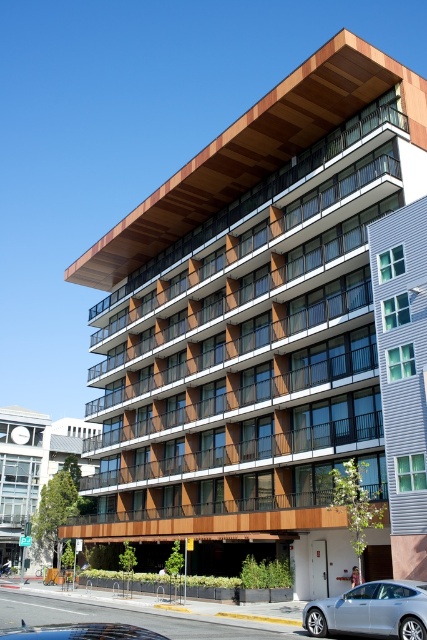
Question: Which point is farther from the camera taking this photo?

Choices:
 (A) (347, 621)
 (B) (400, 304)
 (C) (20, 512)

Answer: (C)

Question: Does green glass windows at upper right appear over silver metallic car at lower right?

Choices:
 (A) yes
 (B) no

Answer: (A)

Question: Is matte gray building at center behind silver metallic car at lower right?

Choices:
 (A) yes
 (B) no

Answer: (A)

Question: Does green glass windows at upper right have a greater width compared to matte gray building at center?

Choices:
 (A) yes
 (B) no

Answer: (B)

Question: Which point is closer to the camera?

Choices:
 (A) (34, 442)
 (B) (395, 541)
 (C) (408, 636)

Answer: (C)

Question: Which of the following is the farthest from the observer?

Choices:
 (A) silver metallic car at lower right
 (B) matte gray building at center
 (C) green glass windows at upper right

Answer: (B)